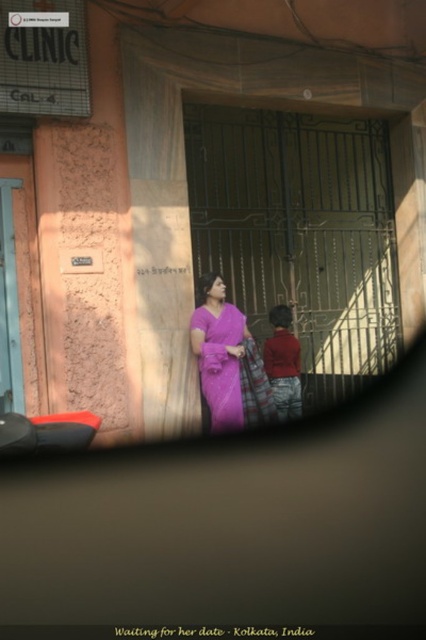
Is purple silk saree at center taller than red cotton robe at center?

Correct, purple silk saree at center is much taller as red cotton robe at center.

Does point (226, 374) come behind point (293, 380)?

No, (226, 374) is closer to viewer.

Is point (204, 396) behind point (293, 346)?

That is False.

Image resolution: width=426 pixels, height=640 pixels. What are the coordinates of `purple silk saree at center` in the screenshot? It's located at (218, 353).